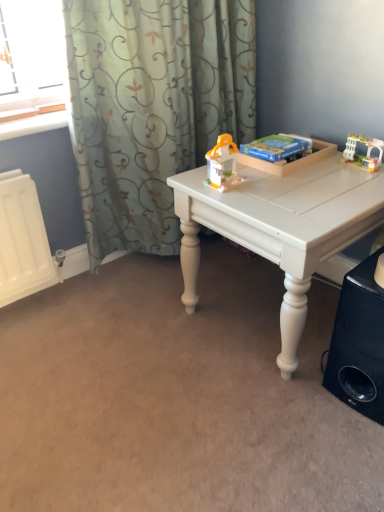
At what (x,y) coordinates should I click in order to perform the action: click on vacant space to the left of white matte table at center. Please return your answer as a coordinate pair (x, y). Looking at the image, I should click on (137, 342).